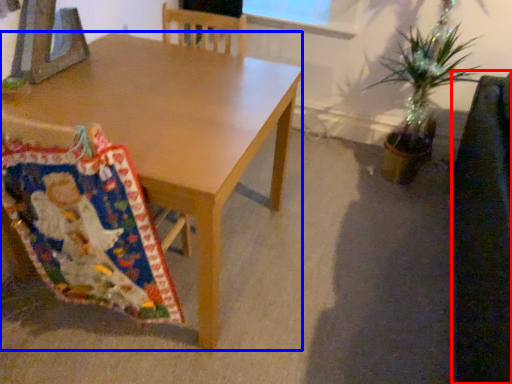
Question: Among these objects, which one is farthest to the camera, swivel chair (highlighted by a red box) or desk (highlighted by a blue box)?

Choices:
 (A) swivel chair
 (B) desk

Answer: (B)